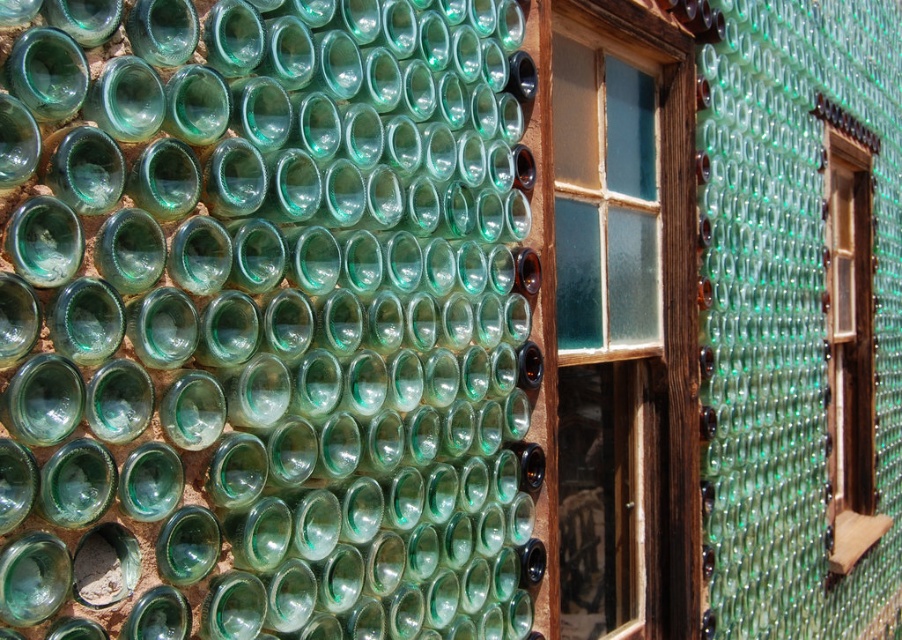
You are standing in front of the bottle wall and notice two points marked on it. The first point is at coordinate point (49, 316) and the second is at point (677, 433). Which point is nearer to your eyes?

Point (49, 316) is closer to the camera than point (677, 433), so the first point is nearer to your eyes.